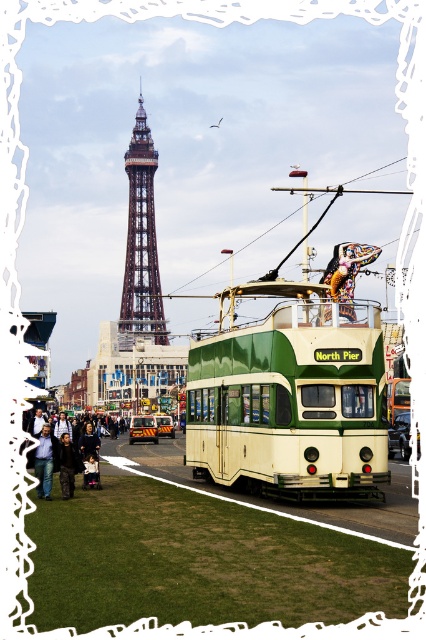
Question: Does dark blue jeans at lower left have a greater width compared to jeans at lower left?

Choices:
 (A) yes
 (B) no

Answer: (A)

Question: Is brown wooden tower at center to the left of dark blue leather jacket at lower left from the viewer's perspective?

Choices:
 (A) no
 (B) yes

Answer: (B)

Question: Can you confirm if green matte/deck bus at center is positioned to the left of dark blue jeans at lower left?

Choices:
 (A) yes
 (B) no

Answer: (B)

Question: Which is nearer to the dark blue jeans at lower left?

Choices:
 (A) dark blue leather jacket at lower left
 (B) green matte/deck bus at center
 (C) brown wooden tower at center
 (D) jeans at lower left

Answer: (A)

Question: Which point appears farthest from the camera in this image?

Choices:
 (A) (62, 454)
 (B) (72, 472)

Answer: (A)

Question: Considering the real-world distances, which object is closest to the dark blue leather jacket at lower left?

Choices:
 (A) green matte/deck bus at center
 (B) brown wooden tower at center
 (C) jeans at lower left

Answer: (C)